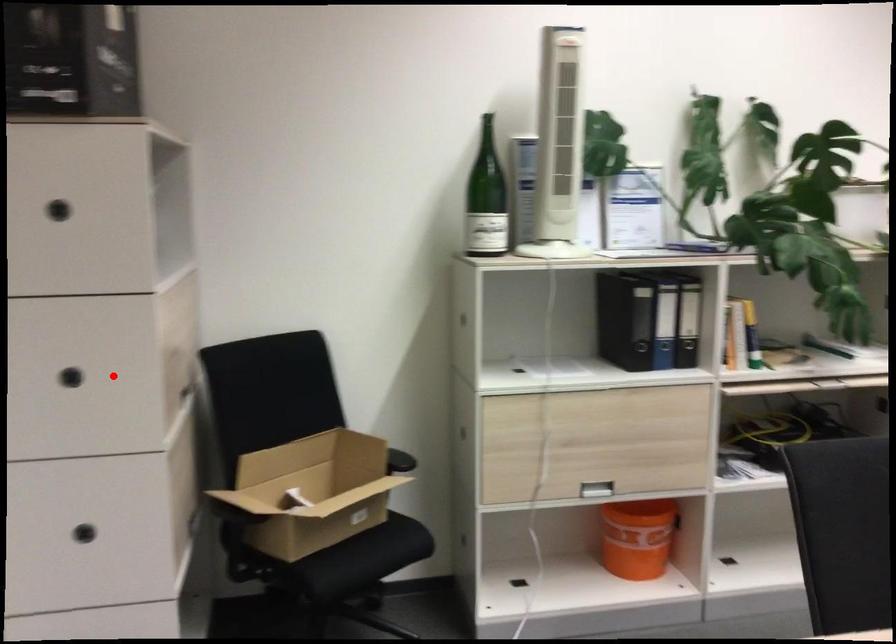
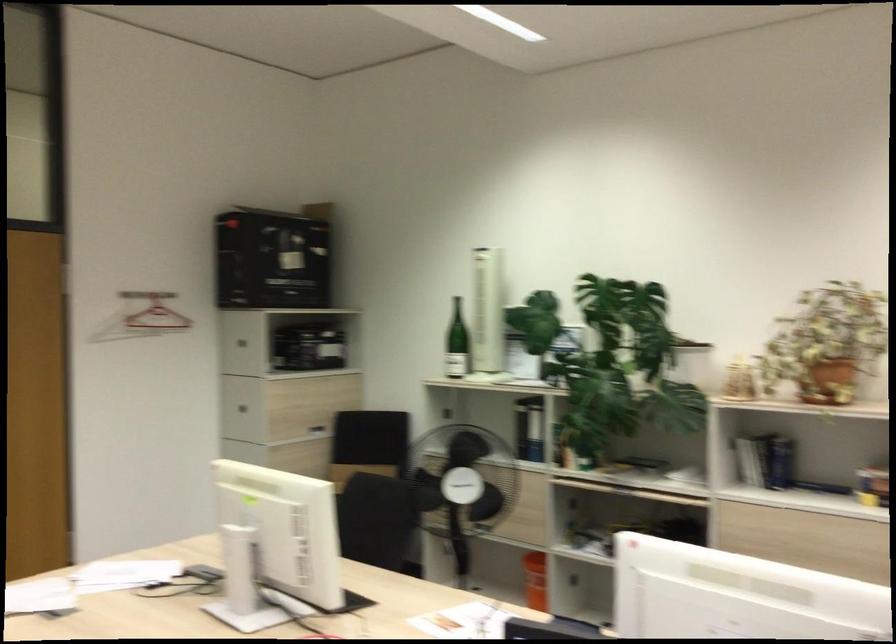
Question: I am providing you with two images of the same scene from different viewpoints. In image1, a red point is highlighted. Considering the same 3D point in image2, which of the following is correct?

Choices:
 (A) It is closer
 (B) It is farther

Answer: (B)